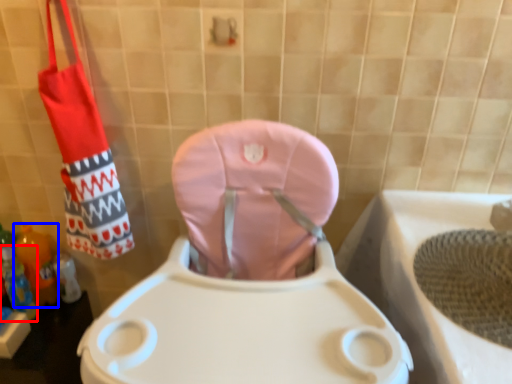
Question: Among these objects, which one is farthest to the camera, bottle (highlighted by a red box) or bottle (highlighted by a blue box)?

Choices:
 (A) bottle
 (B) bottle

Answer: (B)